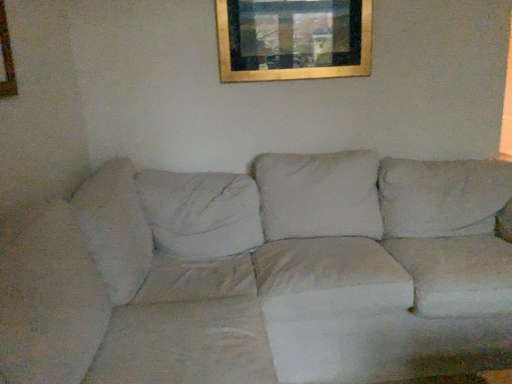
Question: Is gold metallic picture frame at upper center bigger than white fabric couch at center?

Choices:
 (A) no
 (B) yes

Answer: (A)

Question: From the image's perspective, is gold metallic picture frame at upper center under white fabric couch at center?

Choices:
 (A) no
 (B) yes

Answer: (A)

Question: Considering the relative sizes of gold metallic picture frame at upper center and white fabric couch at center in the image provided, is gold metallic picture frame at upper center taller than white fabric couch at center?

Choices:
 (A) no
 (B) yes

Answer: (A)

Question: Is gold metallic picture frame at upper center not within white fabric couch at center?

Choices:
 (A) no
 (B) yes

Answer: (B)

Question: Is gold metallic picture frame at upper center touching white fabric couch at center?

Choices:
 (A) yes
 (B) no

Answer: (B)

Question: Is the depth of gold metallic picture frame at upper center greater than that of white fabric couch at center?

Choices:
 (A) no
 (B) yes

Answer: (B)

Question: Is white fabric couch at center bigger than gold metallic picture frame at upper center?

Choices:
 (A) no
 (B) yes

Answer: (B)

Question: From the image's perspective, is white fabric couch at center located above gold metallic picture frame at upper center?

Choices:
 (A) no
 (B) yes

Answer: (A)

Question: Can you confirm if white fabric couch at center is taller than gold metallic picture frame at upper center?

Choices:
 (A) no
 (B) yes

Answer: (B)

Question: From the image's perspective, would you say white fabric couch at center is shown under gold metallic picture frame at upper center?

Choices:
 (A) no
 (B) yes

Answer: (B)

Question: Is white fabric couch at center positioned far away from gold metallic picture frame at upper center?

Choices:
 (A) no
 (B) yes

Answer: (A)

Question: Does white fabric couch at center have a lesser width compared to gold metallic picture frame at upper center?

Choices:
 (A) yes
 (B) no

Answer: (B)

Question: Considering the positions of white fabric couch at center and gold metallic picture frame at upper center in the image, is white fabric couch at center wider or thinner than gold metallic picture frame at upper center?

Choices:
 (A) wide
 (B) thin

Answer: (A)